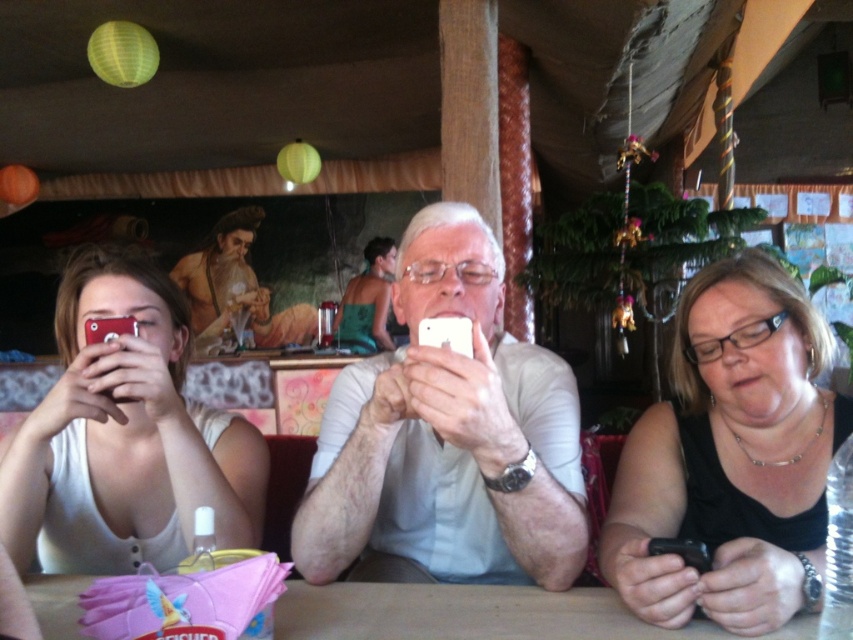
Question: Which is farther from the white matte shirt at center?

Choices:
 (A) white matte phone at center
 (B) black matte phone at center right

Answer: (B)

Question: Which point is farther from the camera taking this photo?

Choices:
 (A) (521, 637)
 (B) (364, 532)
 (C) (244, 426)

Answer: (C)

Question: Is black matte phone at center right positioned at the back of green fabric bikini top at center?

Choices:
 (A) no
 (B) yes

Answer: (A)

Question: Can you confirm if matte white tank top at left is positioned above wooden table at center?

Choices:
 (A) yes
 (B) no

Answer: (A)

Question: Estimate the real-world distances between objects in this image. Which object is farther from the matte white tank top at left?

Choices:
 (A) black matte phone at center right
 (B) wooden table at center
 (C) white matte phone at center

Answer: (A)

Question: Is wooden table at center further to camera compared to green fabric bikini top at center?

Choices:
 (A) yes
 (B) no

Answer: (B)